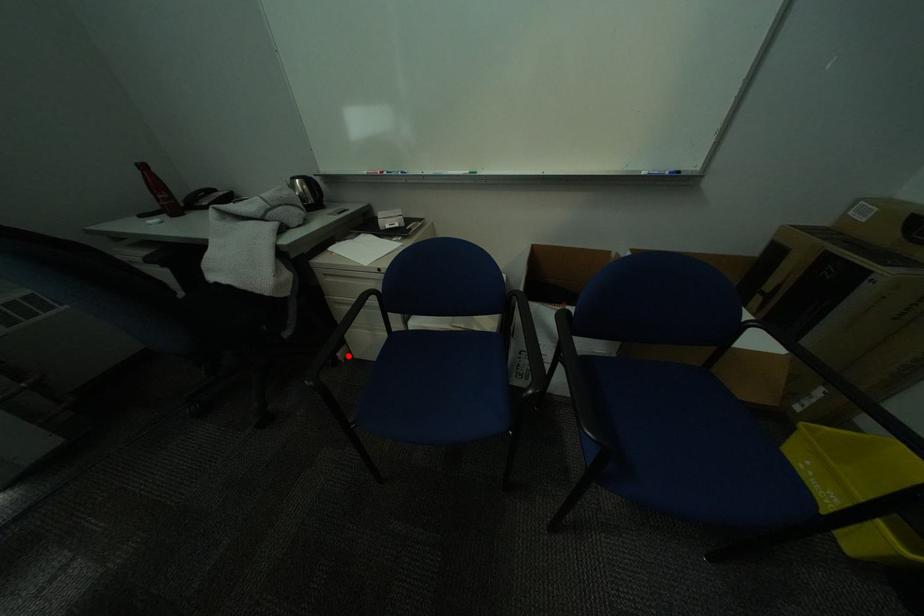
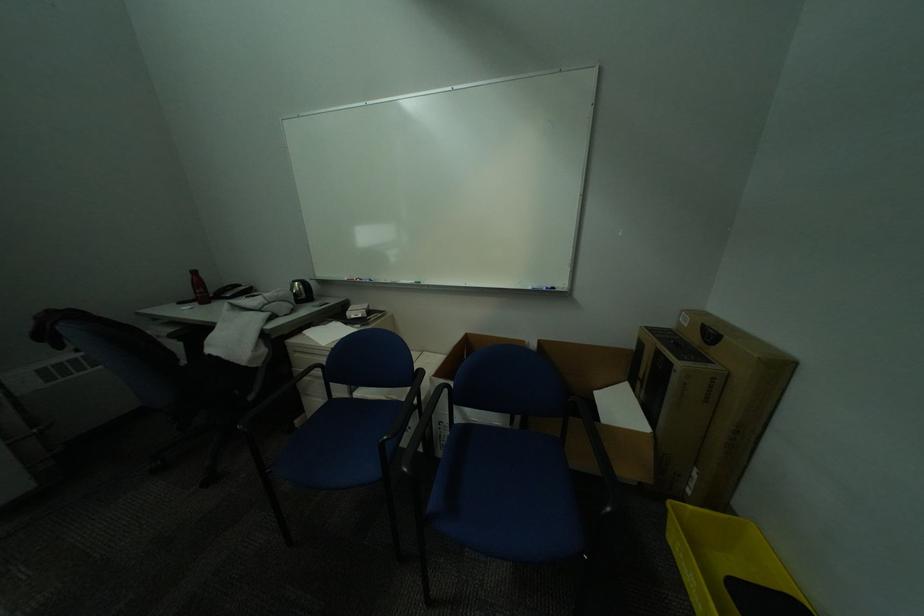
Question: I am providing you with two images of the same scene from different viewpoints. A red point is marked on the first image. At the location where the point appears in image 1, is it still visible in image 2?

Choices:
 (A) Yes
 (B) No

Answer: (A)